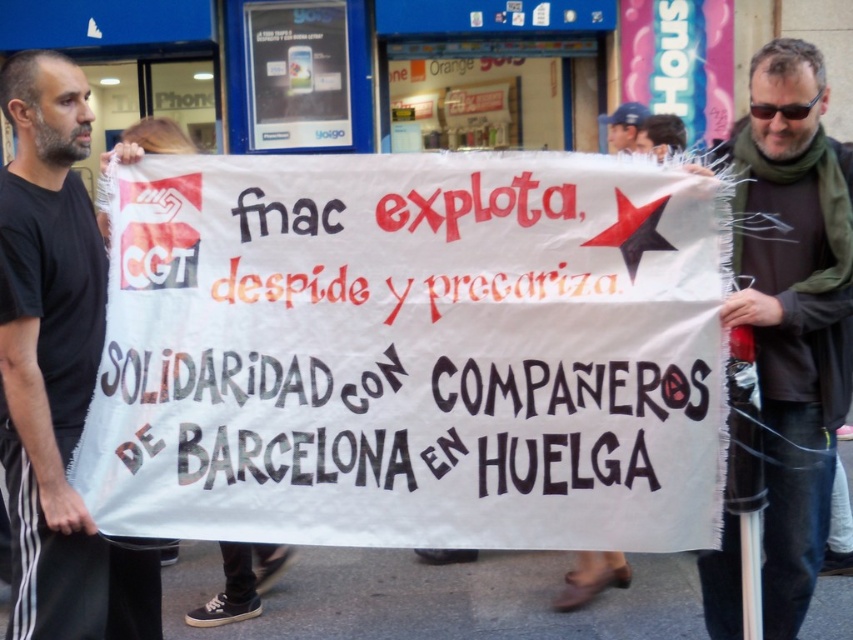
Question: Does dark brown leather jacket at center have a smaller size compared to dark blue cap at upper center?

Choices:
 (A) yes
 (B) no

Answer: (B)

Question: Among these points, which one is nearest to the camera?

Choices:
 (A) (614, 122)
 (B) (654, 388)
 (C) (80, 145)

Answer: (B)

Question: Which point appears closest to the camera in this image?

Choices:
 (A) (412, 404)
 (B) (619, 122)

Answer: (A)

Question: Does black fabric at left come in front of dark brown leather jacket at center?

Choices:
 (A) no
 (B) yes

Answer: (B)

Question: Estimate the real-world distances between objects in this image. Which object is closer to the black fabric at left?

Choices:
 (A) dark blue cap at upper center
 (B) dark brown leather jacket at center
 (C) white paper banner at center

Answer: (C)

Question: Can you confirm if white paper banner at center is positioned to the left of dark brown leather jacket at center?

Choices:
 (A) yes
 (B) no

Answer: (A)